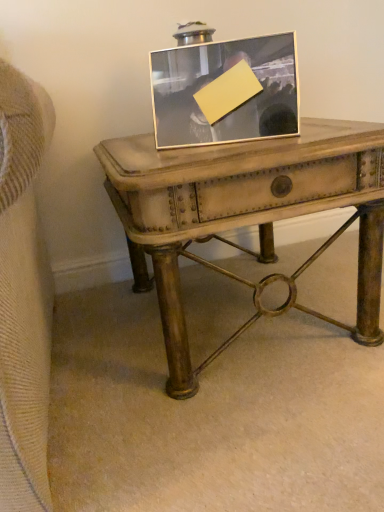
Question: Looking at their shapes, would you say distressed wood table at center is wider or thinner than silver/metallic picture frame at center?

Choices:
 (A) wide
 (B) thin

Answer: (A)

Question: Do you think distressed wood table at center is within silver/metallic picture frame at center, or outside of it?

Choices:
 (A) outside
 (B) inside

Answer: (A)

Question: In terms of height, does distressed wood table at center look taller or shorter compared to silver/metallic picture frame at center?

Choices:
 (A) short
 (B) tall

Answer: (B)

Question: Is silver/metallic picture frame at center bigger or smaller than distressed wood table at center?

Choices:
 (A) big
 (B) small

Answer: (B)

Question: Based on their positions, is silver/metallic picture frame at center located to the left or right of distressed wood table at center?

Choices:
 (A) right
 (B) left

Answer: (B)

Question: Which is correct: silver/metallic picture frame at center is inside distressed wood table at center, or outside of it?

Choices:
 (A) inside
 (B) outside

Answer: (B)

Question: From the image's perspective, is silver/metallic picture frame at center above or below distressed wood table at center?

Choices:
 (A) above
 (B) below

Answer: (A)